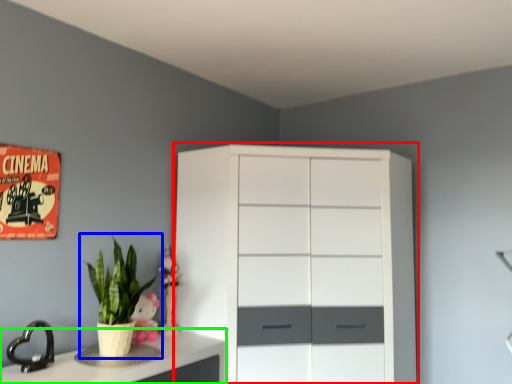
Question: Considering the real-world distances, which object is farthest from chest of drawers (highlighted by a red box)? houseplant (highlighted by a blue box) or counter top (highlighted by a green box)?

Choices:
 (A) houseplant
 (B) counter top

Answer: (A)